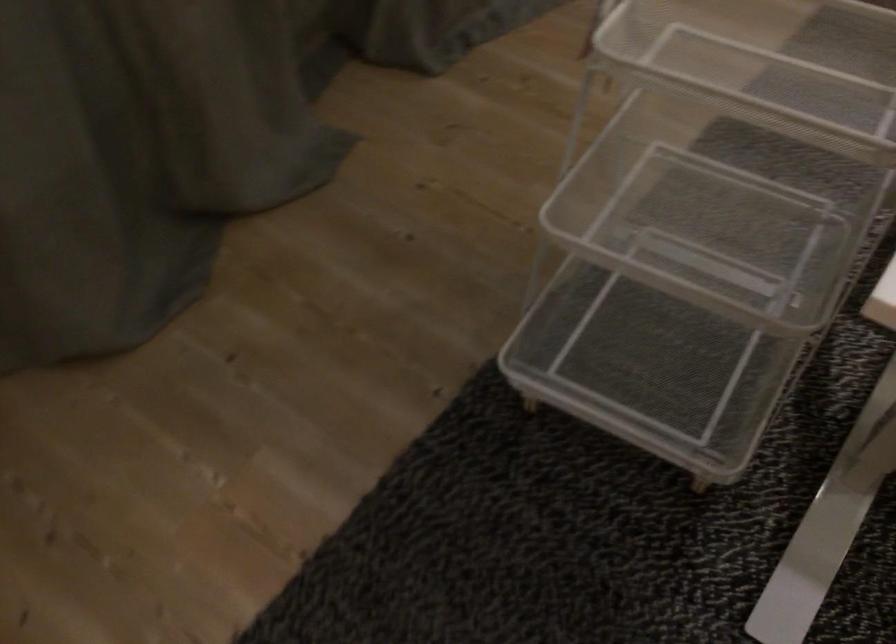
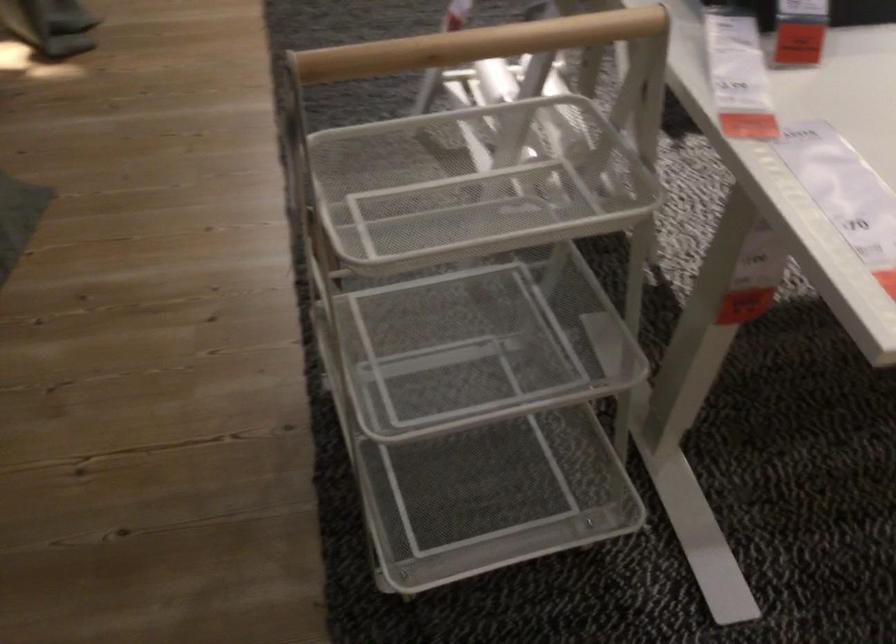
Question: The camera is either moving clockwise (left) or counter-clockwise (right) around the object. The first image is from the beginning of the video and the second image is from the end. Is the camera moving left or right when shooting the video?

Choices:
 (A) Left
 (B) Right

Answer: (A)